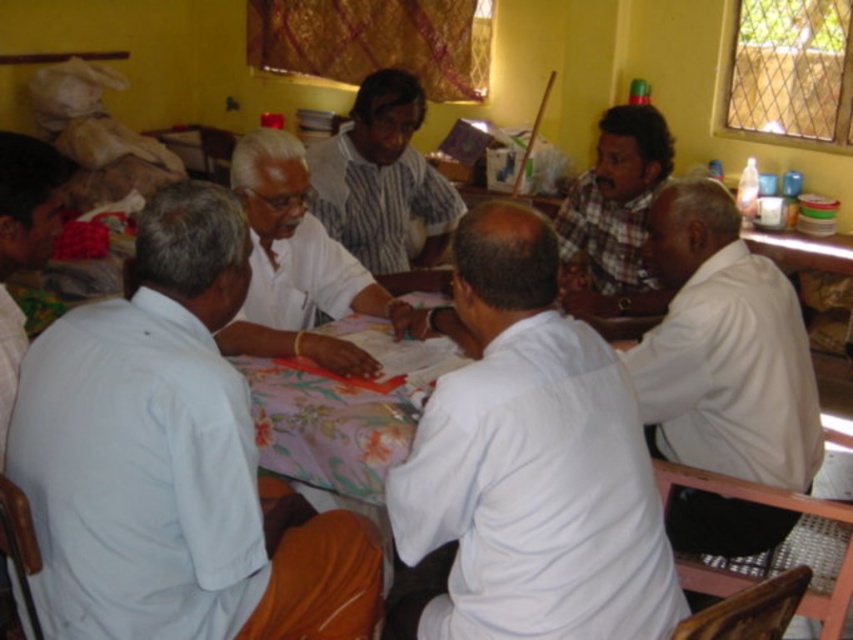
You are standing in the room and want to hand a document to the person wearing the white cotton shirt at center. Based on their position, where should you approach from?

The white cotton shirt at center is located at coordinates point [527,465], so you should approach from the front to hand the document directly to them.

You are standing in the room and want to move from point A to point B. Point A is located at coordinates point (592, 179) and point B is at point (12, 138). Considering the spatial relationship between these points, which direction should you move to reach point B from point A?

To move from point A to point B, you should move downward since point A is further to the viewer than point B, meaning it is closer to you. Moving towards point B would require going in the direction away from your current position towards the lower part of the scene.